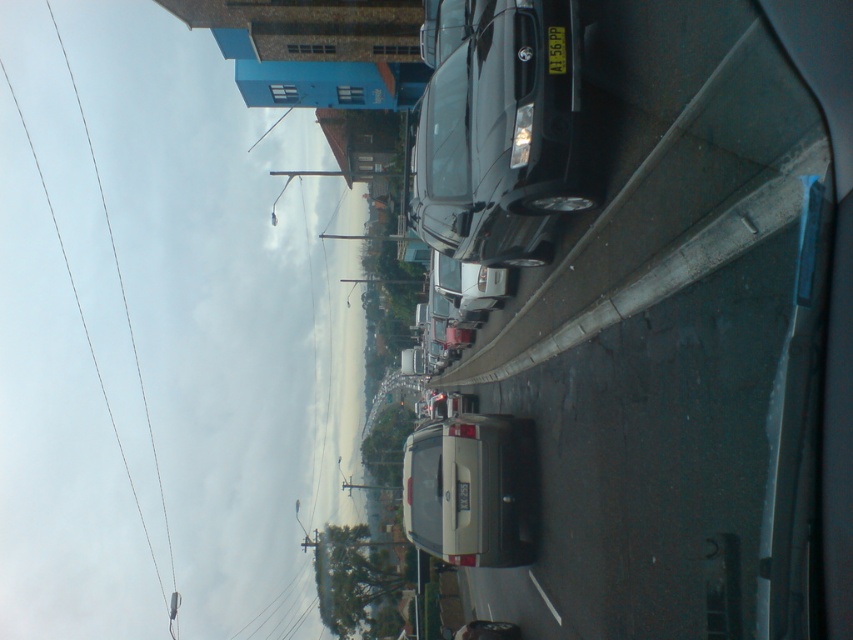
Can you confirm if shiny black car at center is positioned below matte silver van at center?

No, shiny black car at center is not below matte silver van at center.

Who is more distant from viewer, (490, 81) or (511, 625)?

Positioned behind is point (511, 625).

Locate an element on the screen. Image resolution: width=853 pixels, height=640 pixels. shiny black car at center is located at coordinates (498, 134).

Can you confirm if shiny black car at center is shorter than black plastic license plate at center?

No.

Consider the image. Can you confirm if shiny black car at center is thinner than black plastic license plate at center?

No.

Is point (456, 211) positioned in front of point (555, 49)?

No, (456, 211) is further to viewer.

Where is `shiny black car at center`? This screenshot has height=640, width=853. shiny black car at center is located at coordinates (498, 134).

Does point (479, 625) lie behind point (548, 60)?

Yes, it is.

Find the location of a particular element. Image resolution: width=853 pixels, height=640 pixels. matte silver van at center is located at coordinates (486, 630).